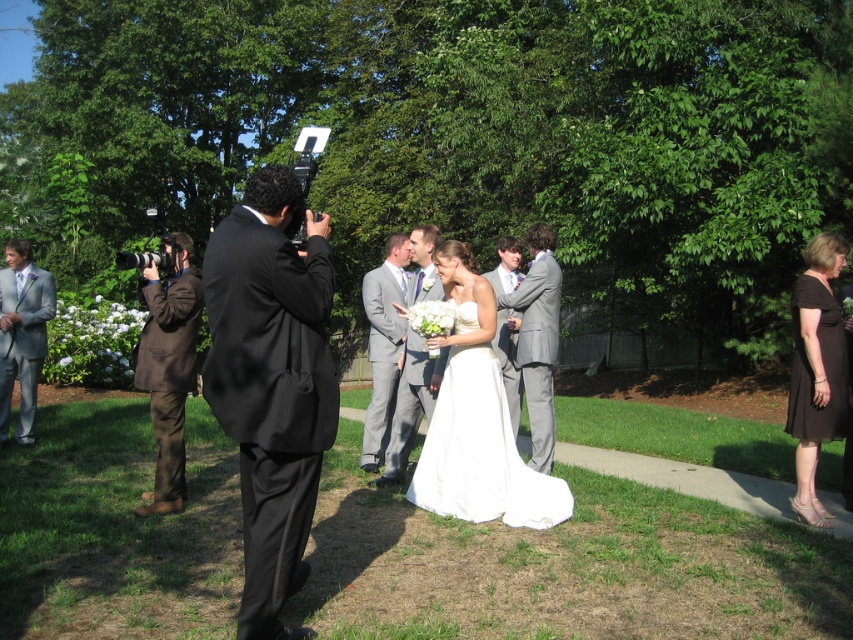
Question: Which of the following is the farthest from the observer?

Choices:
 (A) (494, 493)
 (B) (386, 305)
 (C) (512, 392)

Answer: (C)

Question: Does light gray suit at left appear over gray satin suit at center?

Choices:
 (A) yes
 (B) no

Answer: (A)

Question: Does white satin dress at center appear under light gray suit at center?

Choices:
 (A) yes
 (B) no

Answer: (A)

Question: Is light gray suit at left thinner than gray satin suit at center?

Choices:
 (A) yes
 (B) no

Answer: (B)

Question: Which point is closer to the camera?

Choices:
 (A) gray satin suit at center
 (B) brown wool suit at left
 (C) light gray suit at center

Answer: (B)

Question: Among these points, which one is farthest from the camera?

Choices:
 (A) (792, 312)
 (B) (511, 387)
 (C) (422, 298)
 (D) (384, 339)

Answer: (B)